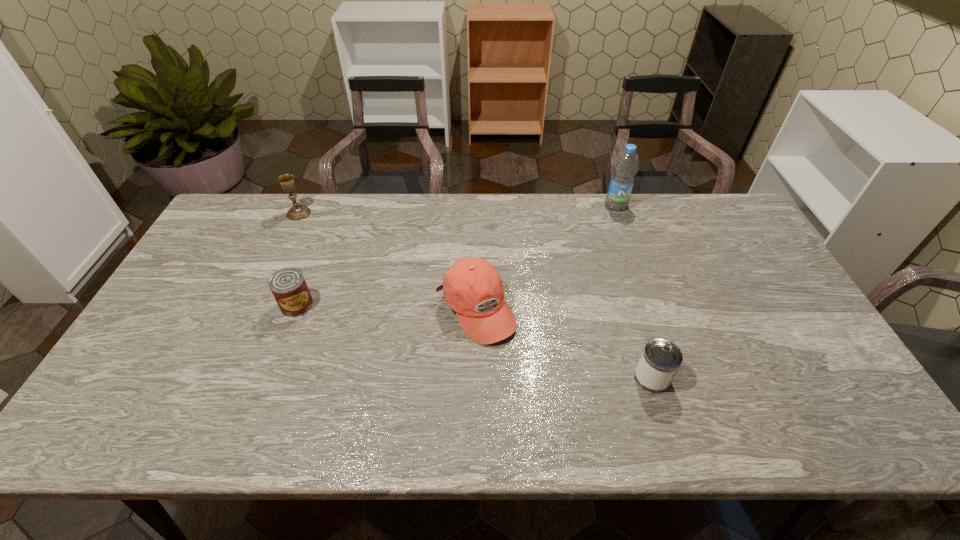
Identify the location of the tallest object. (626, 166).

The height and width of the screenshot is (540, 960). Identify the location of the leftmost object. (296, 212).

You are a GUI agent. You are given a task and a screenshot of the screen. Output one action in this format:
    pyautogui.click(x=<x>, y=<y>)
    Task: Click on the baseball cap
    This screenshot has width=960, height=540.
    Given the screenshot: What is the action you would take?
    pyautogui.click(x=472, y=287)

Image resolution: width=960 pixels, height=540 pixels. In order to click on the fourth object from right to left in this screenshot , I will do pos(288,286).

This screenshot has height=540, width=960. In order to click on the left can in this screenshot , I will do `click(288, 286)`.

The height and width of the screenshot is (540, 960). I want to click on the right can, so click(x=661, y=359).

You are a GUI agent. You are given a task and a screenshot of the screen. Output one action in this format:
    pyautogui.click(x=<x>, y=<y>)
    Task: Click on the nearer can
    The image size is (960, 540).
    Given the screenshot: What is the action you would take?
    661,359

Identify the location of vacant space located 0.360m on the left of the tallest object. (502, 205).

Find the location of a particular element. vacant area situated 0.260m on the right of the chalice is located at coordinates click(386, 213).

At what (x,y) coordinates should I click in order to perform the action: click on free space located on the back of the third object from left to right. Please return your answer as a coordinate pair (x, y). Image resolution: width=960 pixels, height=540 pixels. Looking at the image, I should click on coord(476,252).